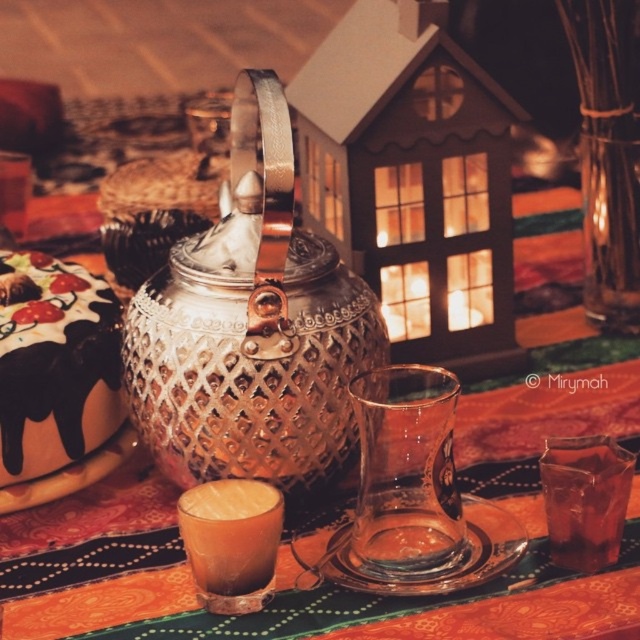
Question: Is transparent glass at center positioned in front of translucent glass at lower right?

Choices:
 (A) no
 (B) yes

Answer: (B)

Question: Does polished copper teapot at center appear over translucent glass at lower right?

Choices:
 (A) yes
 (B) no

Answer: (A)

Question: Which point appears closest to the camera in this image?

Choices:
 (A) (584, 452)
 (B) (244, 275)
 (C) (369, 429)

Answer: (C)

Question: Among these objects, which one is nearest to the camera?

Choices:
 (A) transparent glass at center
 (B) translucent glass at lower right
 (C) polished copper teapot at center

Answer: (A)

Question: Is transparent glass at center above translucent glass at lower right?

Choices:
 (A) no
 (B) yes

Answer: (B)

Question: Considering the real-world distances, which object is farthest from the polished copper teapot at center?

Choices:
 (A) transparent glass at center
 (B) translucent glass at lower right

Answer: (B)